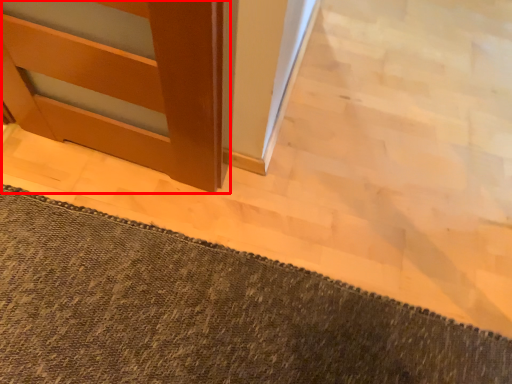
Question: From the image's perspective, where is door (annotated by the red box) located relative to bath mat?

Choices:
 (A) below
 (B) above

Answer: (B)